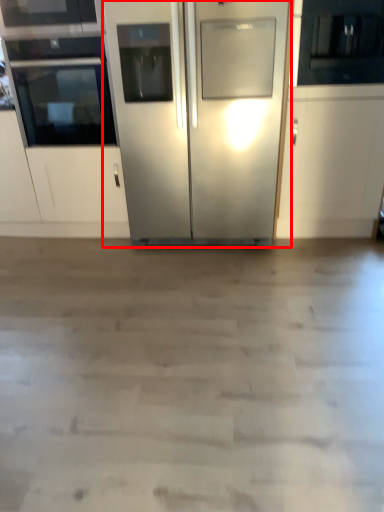
Question: Observing the image, what is the correct spatial positioning of refrigerator (annotated by the red box) in reference to oven?

Choices:
 (A) right
 (B) left

Answer: (A)